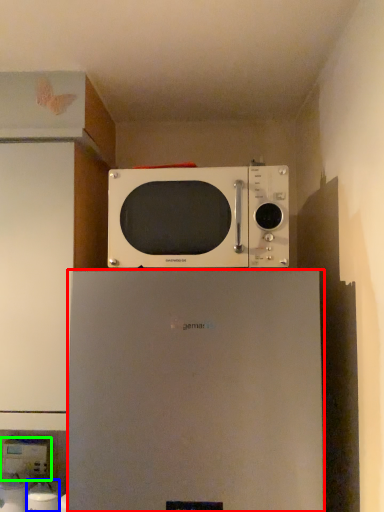
Question: Which object is the farthest from refrigerator (highlighted by a red box)? Choose among these: appliance (highlighted by a blue box) or appliance (highlighted by a green box).

Choices:
 (A) appliance
 (B) appliance

Answer: (B)